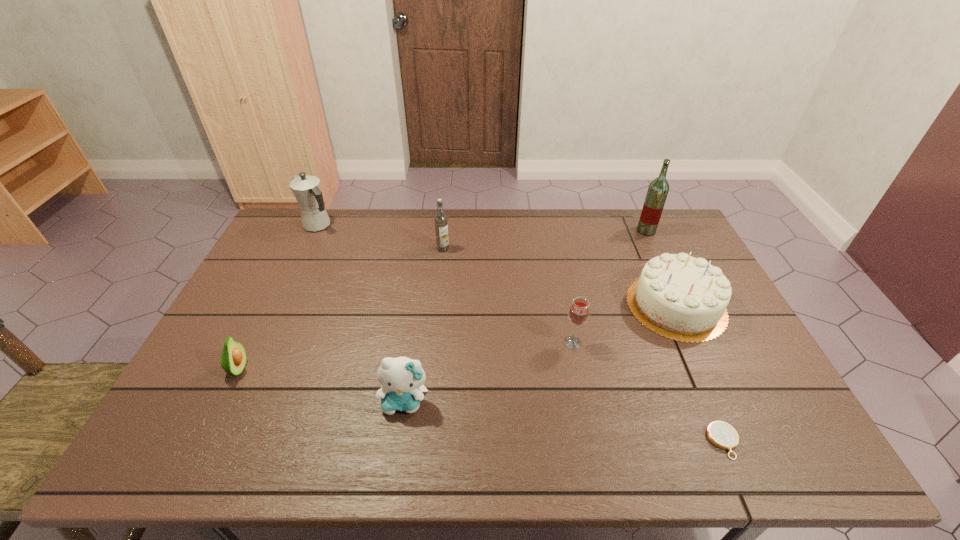
Identify the location of empty location between the shortest object and the fourth object from right to left. (648, 392).

Where is `free space between the tallest object and the coffeepot`? This screenshot has height=540, width=960. free space between the tallest object and the coffeepot is located at coordinates (483, 228).

Choose which object is the fourth nearest neighbor to the liquor. Please provide its 2D coordinates. Your answer should be formatted as a tuple, i.e. [(x, y)], where the tuple contains the x and y coordinates of a point satisfying the conditions above.

[(721, 434)]

Where is `object that can be found as the fifth closest to the vodka`? This screenshot has width=960, height=540. object that can be found as the fifth closest to the vodka is located at coordinates (233, 359).

At what (x,y) coordinates should I click in order to perform the action: click on free space that satisfies the following two spatial constraints: 1. on the front side of the coffeepot; 2. on the cut side of the avocado. Please return your answer as a coordinate pair (x, y). This screenshot has width=960, height=540. Looking at the image, I should click on (252, 370).

The height and width of the screenshot is (540, 960). In order to click on free space that satisfies the following two spatial constraints: 1. on the label of the vodka; 2. on the right side of the fifth object from left to right in this screenshot , I will do `click(434, 342)`.

Find the location of `free space that satisfies the following two spatial constraints: 1. on the front side of the tallest object; 2. on the cut side of the third nearest object`. free space that satisfies the following two spatial constraints: 1. on the front side of the tallest object; 2. on the cut side of the third nearest object is located at coordinates (711, 370).

The image size is (960, 540). I want to click on free spot that satisfies the following two spatial constraints: 1. on the cut side of the avocado; 2. on the left side of the shortest object, so (203, 441).